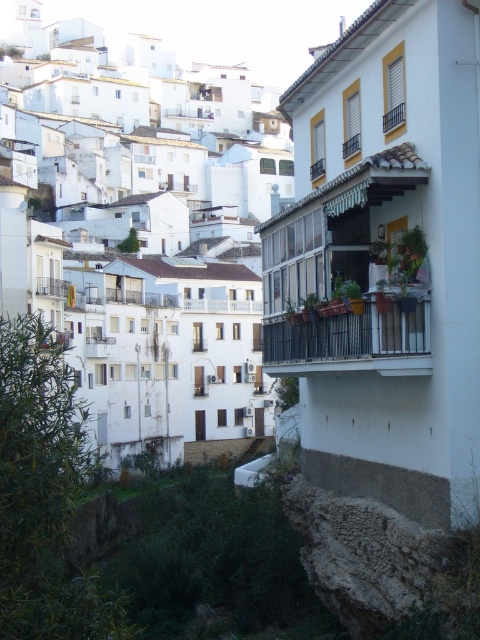
Does white matte building at upper center have a lesser width compared to white wooden balcony at center?

In fact, white matte building at upper center might be wider than white wooden balcony at center.

Between white matte building at upper center and white wooden balcony at center, which one is positioned higher?

white matte building at upper center is above.

This screenshot has width=480, height=640. Describe the element at coordinates (156, 234) in the screenshot. I see `white matte building at upper center` at that location.

You are a GUI agent. You are given a task and a screenshot of the screen. Output one action in this format:
    pyautogui.click(x=<x>, y=<y>)
    Task: Click on the white matte building at upper center
    
    Given the screenshot: What is the action you would take?
    pyautogui.click(x=156, y=234)

Who is taller, black metal balcony at center or white wooden balcony at center?

With more height is black metal balcony at center.

Is point (321, 328) closer to camera compared to point (213, 310)?

That is True.

I want to click on black metal balcony at center, so click(350, 342).

Find the location of a particular element. The height and width of the screenshot is (640, 480). black metal balcony at center is located at coordinates (350, 342).

Can you confirm if white matte building at upper center is smaller than white wooden balcony at upper center?

No.

Is white matte building at upper center thinner than white wooden balcony at upper center?

Incorrect, white matte building at upper center's width is not less than white wooden balcony at upper center's.

What do you see at coordinates (156, 234) in the screenshot? The image size is (480, 640). I see `white matte building at upper center` at bounding box center [156, 234].

This screenshot has width=480, height=640. Find the location of `white matte building at upper center`. white matte building at upper center is located at coordinates (156, 234).